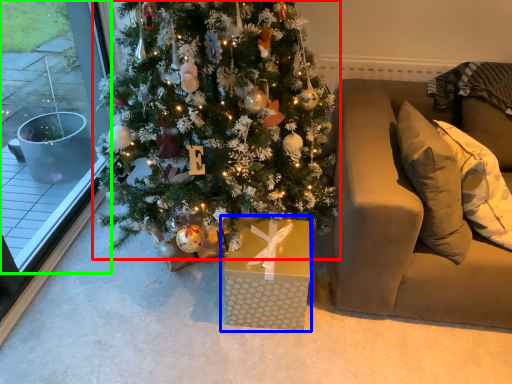
Question: Which is nearer to the christmas tree (highlighted by a red box)? gift box (highlighted by a blue box) or window (highlighted by a green box).

Choices:
 (A) gift box
 (B) window

Answer: (A)